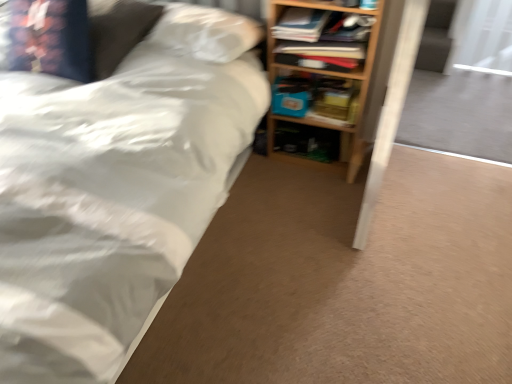
Question: Is matte blue book at center, acting as the 2th book starting from the front, not inside white matte bed at upper left?

Choices:
 (A) yes
 (B) no

Answer: (A)

Question: Does matte blue book at center, acting as the 2th book starting from the front, lie in front of white matte bed at upper left?

Choices:
 (A) yes
 (B) no

Answer: (B)

Question: From a real-world perspective, is matte blue book at center, acting as the 2th book starting from the front, on top of white matte bed at upper left?

Choices:
 (A) yes
 (B) no

Answer: (B)

Question: Is matte blue book at center, acting as the 2th book starting from the front, touching white matte bed at upper left?

Choices:
 (A) yes
 (B) no

Answer: (B)

Question: From the image's perspective, is matte blue book at center, acting as the 2th book starting from the front, located beneath white matte bed at upper left?

Choices:
 (A) no
 (B) yes

Answer: (A)

Question: From the image's perspective, relative to matte blue book at center, acting as the 2th book starting from the front, is transparent plastic screen door at upper right above or below?

Choices:
 (A) below
 (B) above

Answer: (B)

Question: In terms of width, does transparent plastic screen door at upper right look wider or thinner when compared to matte blue book at center, which ranks as the first book in back-to-front order?

Choices:
 (A) wide
 (B) thin

Answer: (B)

Question: Considering the positions of transparent plastic screen door at upper right and matte blue book at center, acting as the 2th book starting from the front, in the image, is transparent plastic screen door at upper right taller or shorter than matte blue book at center, acting as the 2th book starting from the front,?

Choices:
 (A) tall
 (B) short

Answer: (A)

Question: Which is correct: transparent plastic screen door at upper right is inside matte blue book at center, acting as the 2th book starting from the front, or outside of it?

Choices:
 (A) outside
 (B) inside

Answer: (A)

Question: From the image's perspective, is wooden bookshelf at right positioned above or below blue matte paperback book at center?

Choices:
 (A) below
 (B) above

Answer: (B)

Question: Based on their positions, is wooden bookshelf at right located to the left or right of blue matte paperback book at center?

Choices:
 (A) right
 (B) left

Answer: (A)

Question: Is wooden bookshelf at right situated inside blue matte paperback book at center or outside?

Choices:
 (A) inside
 (B) outside

Answer: (B)

Question: Considering the positions of wooden bookshelf at right and blue matte paperback book at center in the image, is wooden bookshelf at right wider or thinner than blue matte paperback book at center?

Choices:
 (A) thin
 (B) wide

Answer: (B)

Question: In the image, is wooden bookshelf at upper right, the first book from the front, on the left side or the right side of white matte bed at upper left?

Choices:
 (A) left
 (B) right

Answer: (B)

Question: Is wooden bookshelf at upper right, the second book in the back-to-front sequence, wider or thinner than white matte bed at upper left?

Choices:
 (A) thin
 (B) wide

Answer: (A)